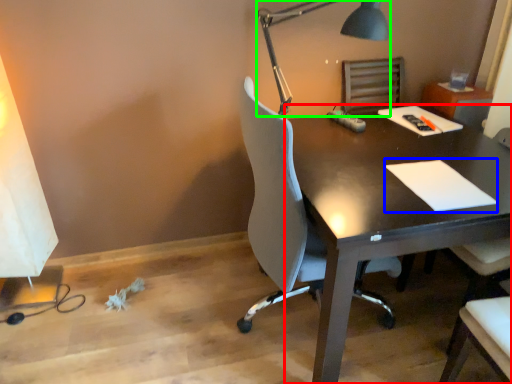
Question: Considering the real-world distances, which object is closest to desk (highlighted by a red box)? notepad (highlighted by a blue box) or lamp (highlighted by a green box).

Choices:
 (A) notepad
 (B) lamp

Answer: (A)